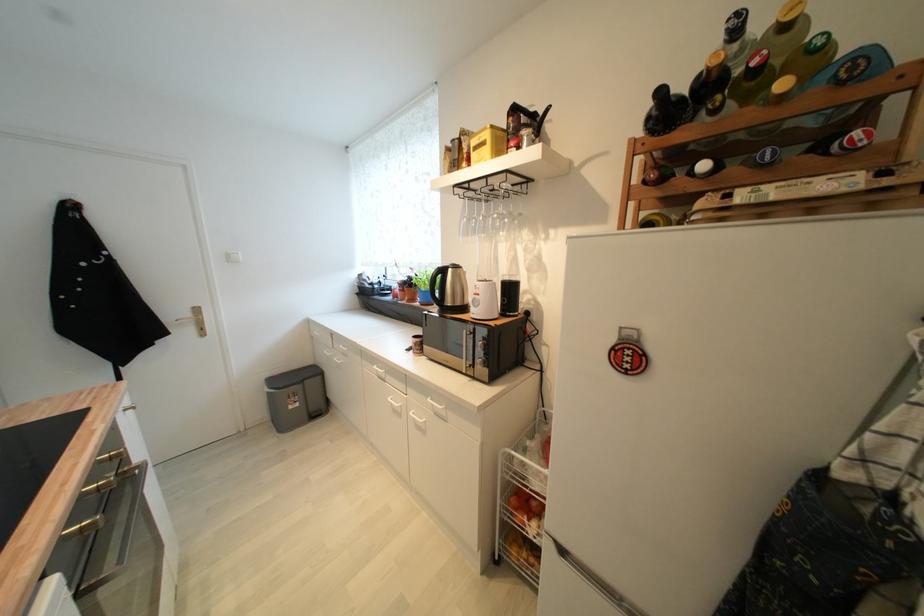
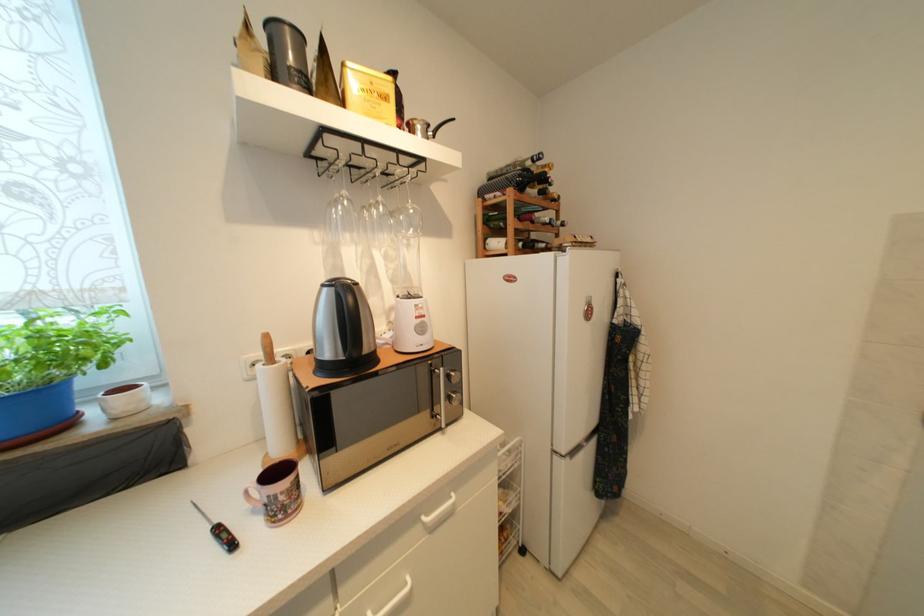
The point at (412, 352) is marked in the first image. Where is the corresponding point in the second image?

(237, 546)